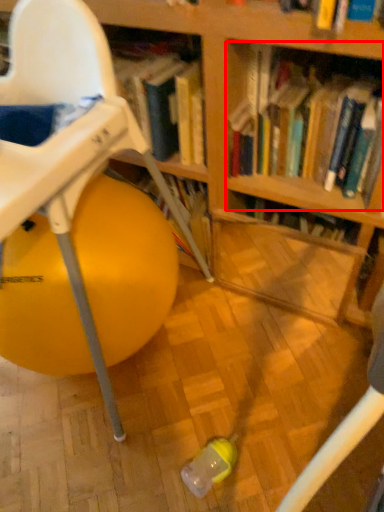
Question: Where is book (annotated by the red box) located in relation to chair in the image?

Choices:
 (A) right
 (B) left

Answer: (A)